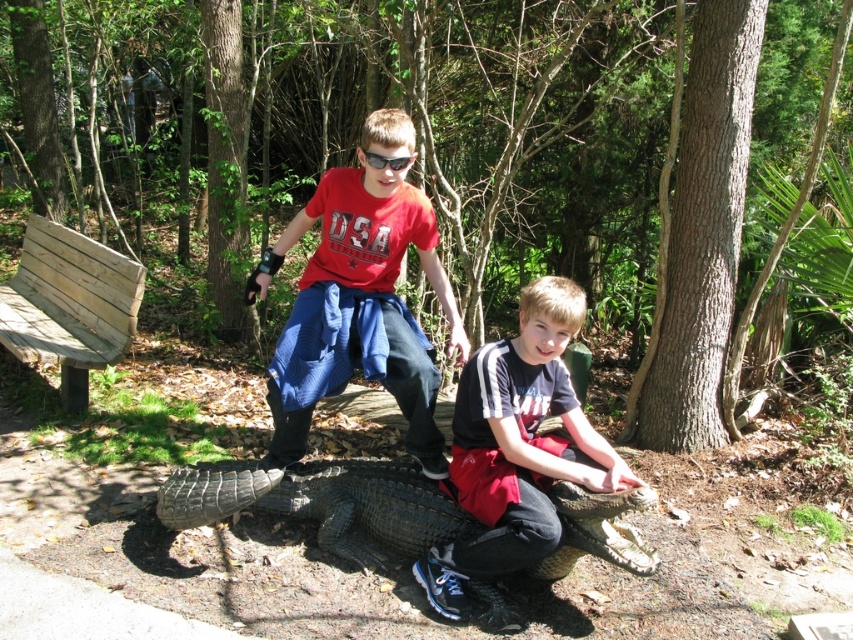
Who is higher up, matte red shirt at center or dark blue denim jeans at lower center?

matte red shirt at center

Does matte red shirt at center have a greater width compared to dark blue denim jeans at lower center?

Indeed, matte red shirt at center has a greater width compared to dark blue denim jeans at lower center.

Between point (337, 380) and point (575, 291), which one is positioned behind?

The point (337, 380) is behind.

The image size is (853, 640). I want to click on matte red shirt at center, so click(x=364, y=292).

Which is above, matte red shirt at center or light brown wooden bench at left?

Positioned higher is light brown wooden bench at left.

I want to click on matte red shirt at center, so click(364, 292).

Image resolution: width=853 pixels, height=640 pixels. What are the coordinates of `matte red shirt at center` in the screenshot? It's located at (364, 292).

Can you confirm if dark blue denim jeans at lower center is thinner than sunglasses at center?

No, dark blue denim jeans at lower center is not thinner than sunglasses at center.

Between dark blue denim jeans at lower center and sunglasses at center, which one has less height?

With less height is sunglasses at center.

This screenshot has width=853, height=640. In order to click on dark blue denim jeans at lower center in this screenshot , I will do `click(517, 449)`.

Where is `dark blue denim jeans at lower center`? Image resolution: width=853 pixels, height=640 pixels. dark blue denim jeans at lower center is located at coordinates (517, 449).